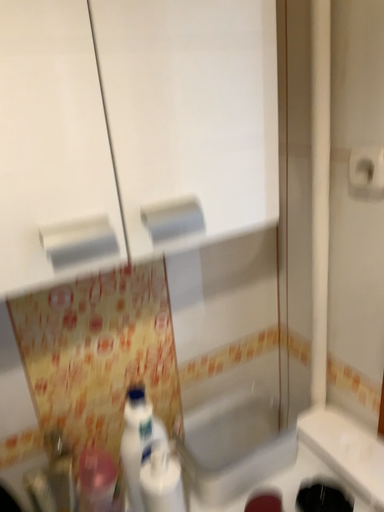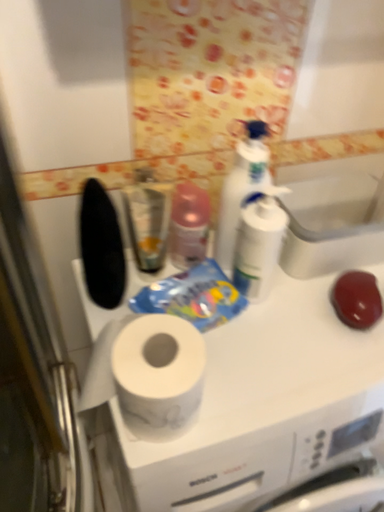
Question: How did the camera likely rotate when shooting the video?

Choices:
 (A) rotated right
 (B) rotated left

Answer: (B)